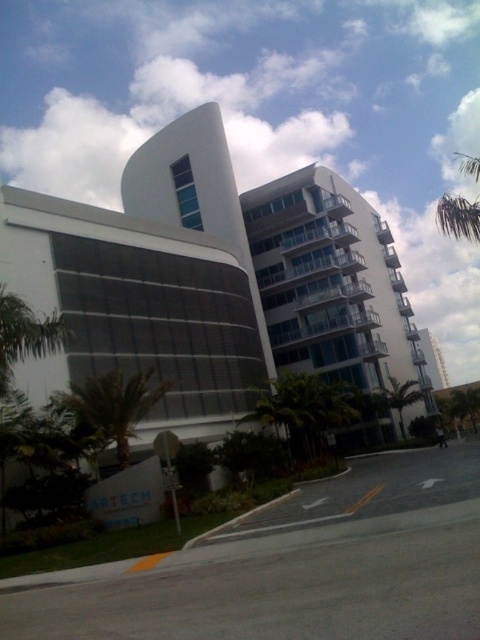
You are standing at the entrance of the ARTECH building and want to take a photo of the glassy white balconies at center and the green leafy palm tree at lower left. Which object should you focus on first if you want to capture both in the frame without moving your camera?

The glassy white balconies at center are wider than the green leafy palm tree at lower left, so you should focus on the glassy white balconies at center first to ensure both fit in the frame.

You are an architect planning to install a new light pole in front of the glassy white balconies at center. Based on the coordinates provided, where should you place the light pole to ensure it is directly in front of them?

The glassy white balconies at center are located at coordinates point [335,291], so the light pole should be placed directly in front of this point along the road in front of the building.